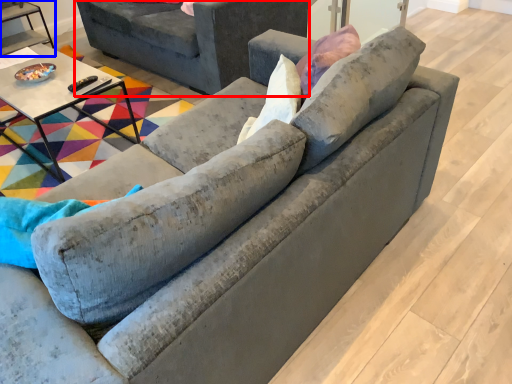
Question: Which object appears farthest to the camera in this image, studio couch (highlighted by a red box) or table (highlighted by a blue box)?

Choices:
 (A) studio couch
 (B) table

Answer: (B)